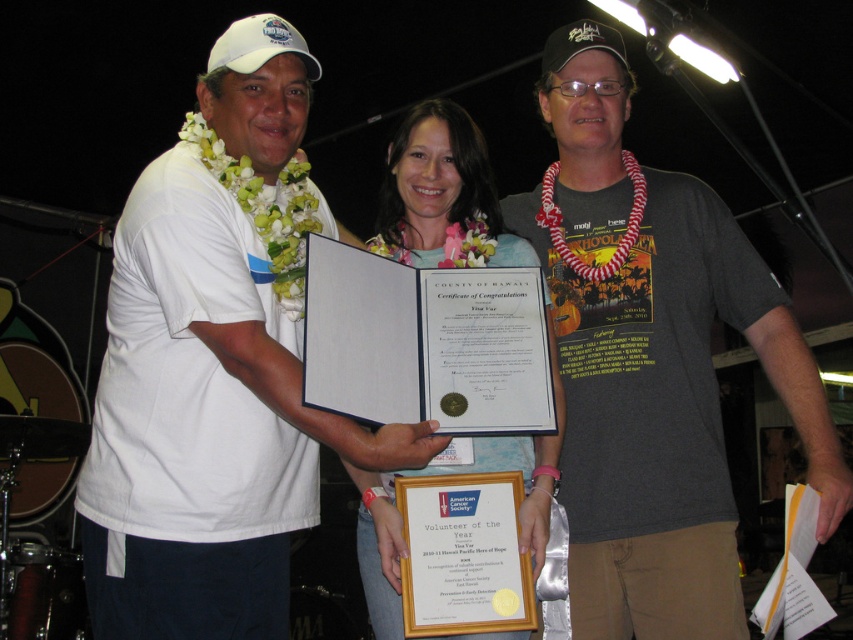
Which is more to the right, gray cotton t-shirt at center or white paper certificate at center?

Positioned to the right is gray cotton t-shirt at center.

Between point (583, 356) and point (433, 134), which one is positioned in front?

Point (433, 134) is more forward.

Locate an element on the screen. This screenshot has height=640, width=853. gray cotton t-shirt at center is located at coordinates (653, 362).

Is point (262, 292) behind point (398, 566)?

Yes.

Who is more distant from viewer, (292, 26) or (410, 256)?

Positioned behind is point (292, 26).

You are a GUI agent. You are given a task and a screenshot of the screen. Output one action in this format:
    pyautogui.click(x=<x>, y=<y>)
    Task: Click on the white matte t-shirt at left
    
    Given the screenshot: What is the action you would take?
    pyautogui.click(x=215, y=369)

Who is positioned more to the right, white matte t-shirt at left or gray cotton t-shirt at center?

gray cotton t-shirt at center

Is the position of white matte t-shirt at left more distant than that of gray cotton t-shirt at center?

No, it is in front of gray cotton t-shirt at center.

This screenshot has width=853, height=640. Describe the element at coordinates (215, 369) in the screenshot. I see `white matte t-shirt at left` at that location.

Identify the location of white matte t-shirt at left. (215, 369).